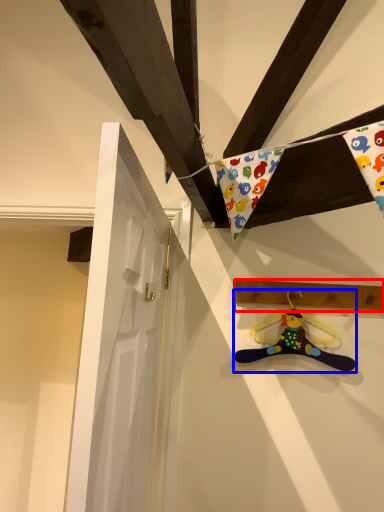
Question: Which point is further to the camera, plank (highlighted by a red box) or toy (highlighted by a blue box)?

Choices:
 (A) plank
 (B) toy

Answer: (A)